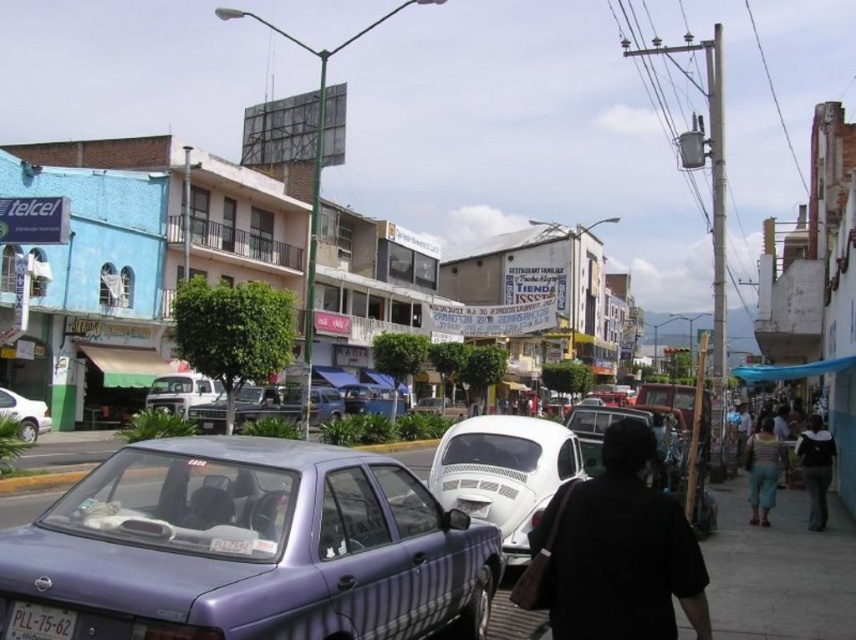
Question: Which object is farther from the camera taking this photo?

Choices:
 (A) white matte car at center
 (B) metallic silver van at center
 (C) purple glossy sedan at center
 (D) metallic silver truck at center

Answer: (D)

Question: Is white matte car at center thinner than black plastic license plate at lower left?

Choices:
 (A) no
 (B) yes

Answer: (A)

Question: Is metallic silver van at center behind matte white car at lower left?

Choices:
 (A) yes
 (B) no

Answer: (B)

Question: Which object is positioned closest to the metallic silver van at center?

Choices:
 (A) matte white truck at center
 (B) metallic silver truck at center
 (C) dark blue jeans at lower right
 (D) matte white car at lower left

Answer: (C)

Question: Which object is closer to the camera taking this photo?

Choices:
 (A) white matte car at center
 (B) black matte shirt at lower right
 (C) denim shorts at lower right

Answer: (B)

Question: Is purple glossy sedan at center bigger than metallic silver van at center?

Choices:
 (A) yes
 (B) no

Answer: (B)